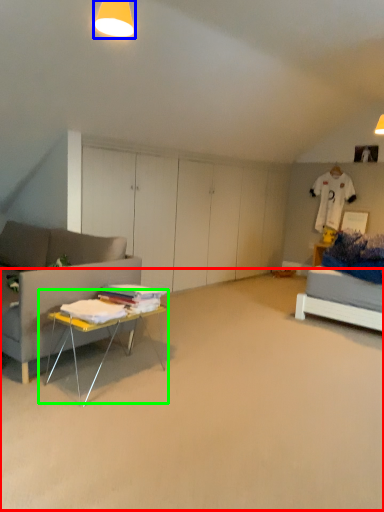
Question: Which is nearer to the plain (highlighted by a red box)? lighting (highlighted by a blue box) or table (highlighted by a green box).

Choices:
 (A) lighting
 (B) table

Answer: (B)